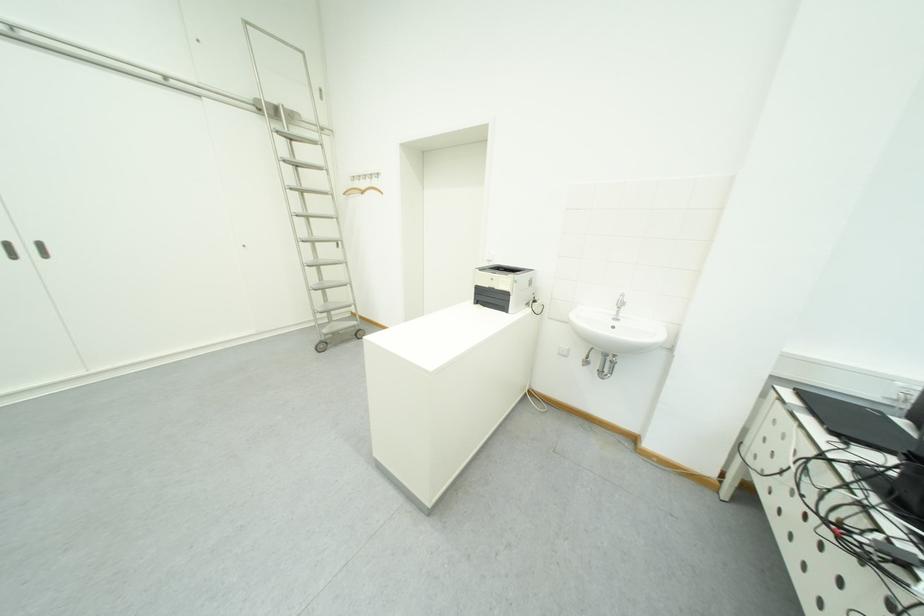
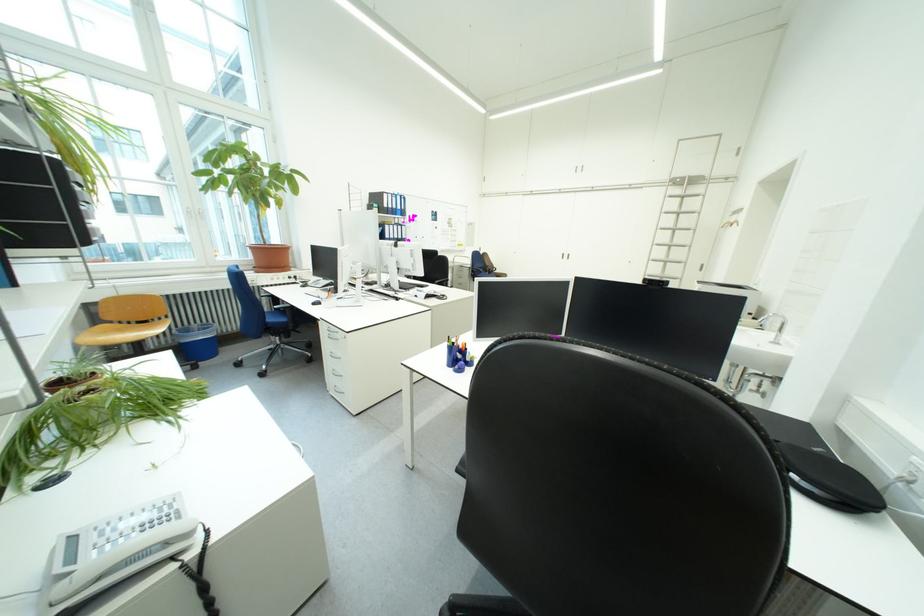
Find the pixel in the second image that matches (x=322, y=213) in the first image.

(687, 244)